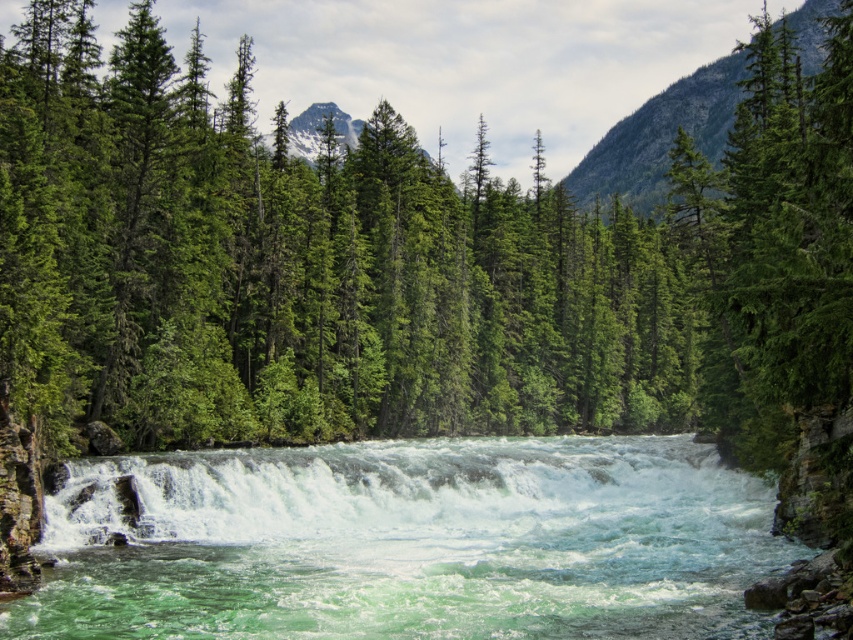
Does green matte tree at center have a lesser width compared to translucent white water at center?

No, green matte tree at center is not thinner than translucent white water at center.

Identify the location of green matte tree at center. (413, 257).

Where is `green matte tree at center`? This screenshot has height=640, width=853. green matte tree at center is located at coordinates (413, 257).